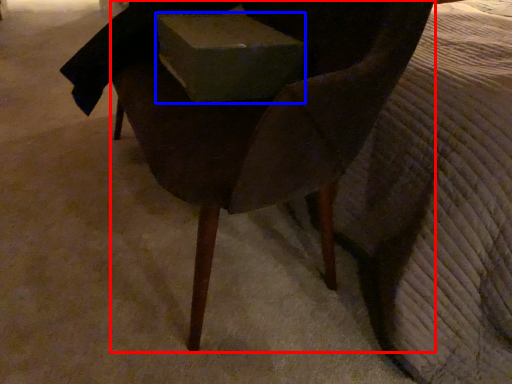
Question: Among these objects, which one is nearest to the camera, chair (highlighted by a red box) or box (highlighted by a blue box)?

Choices:
 (A) chair
 (B) box

Answer: (A)